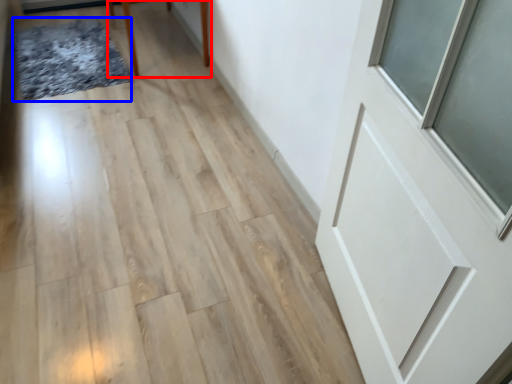
Question: Among these objects, which one is farthest to the camera, furniture (highlighted by a red box) or mat (highlighted by a blue box)?

Choices:
 (A) furniture
 (B) mat

Answer: (B)